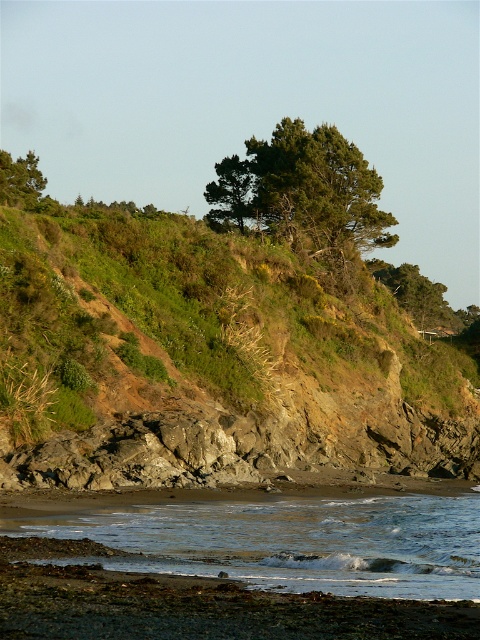
You are standing on the beach and want to take a photo of the green leafy tree at upper center and the clear water at lower center. Which object should you place on the left side of your photo frame?

You should place the clear water at lower center on the left side of your photo frame since it is to the left of the green leafy tree at upper center.

You are a hiker who wants to cross from the clear water at lower center to the green leafy tree at upper center. Given that your average walking speed is 3 feet per second, how many seconds will it take you to reach the tree if you walk directly towards it?

The distance between the clear water at lower center and the green leafy tree at upper center is 136.88 feet. At a walking speed of 3 feet per second, it would take approximately 45.6 seconds to reach the tree.

You are standing on the beach and looking towards the green grassy hillside at upper center and the clear water at lower center. Which object is larger in size?

The green grassy hillside at upper center is bigger than the clear water at lower center.